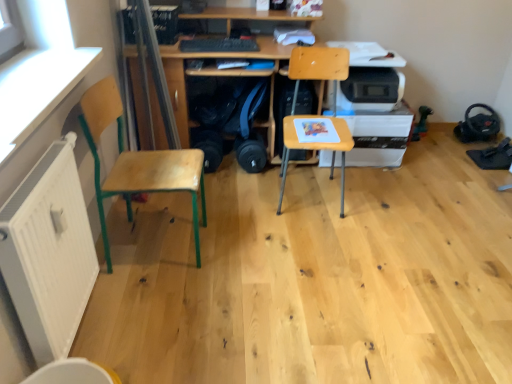
Where is `vacant location below wooden at left, positioned as the 2th chair in right-to-left order (from a real-world perspective)`? Image resolution: width=512 pixels, height=384 pixels. vacant location below wooden at left, positioned as the 2th chair in right-to-left order (from a real-world perspective) is located at coordinates (158, 245).